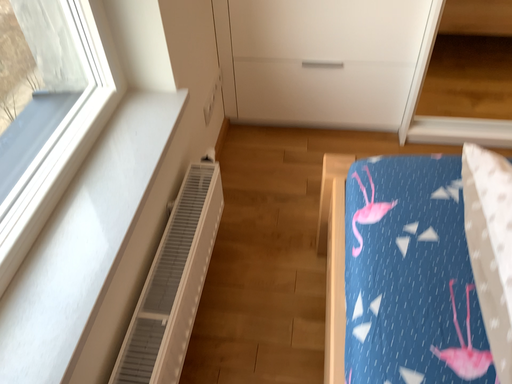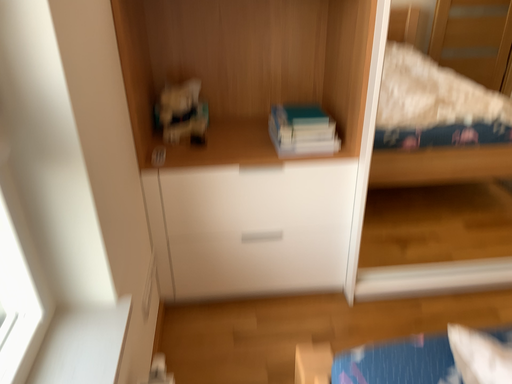
Question: Which way did the camera rotate in the video?

Choices:
 (A) rotated right
 (B) rotated left

Answer: (A)